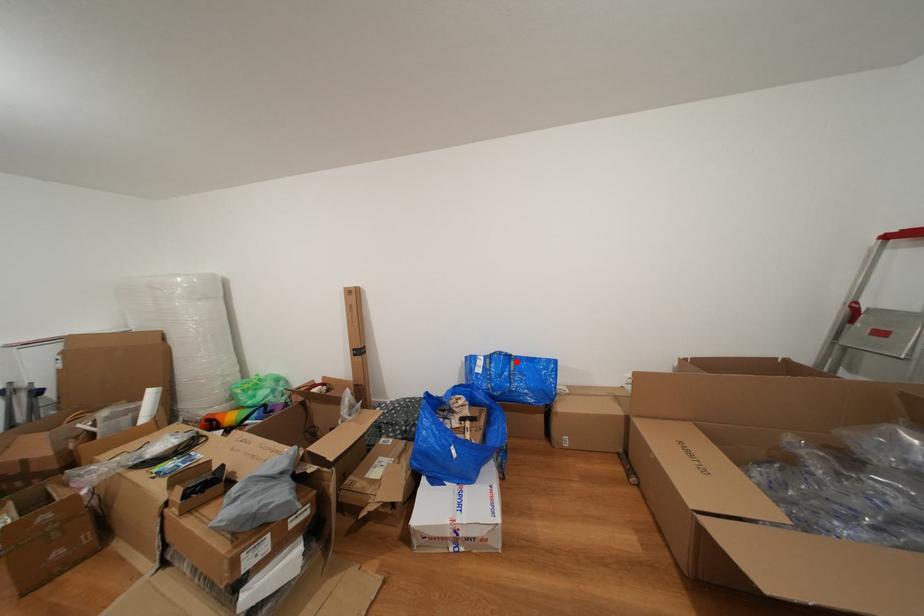
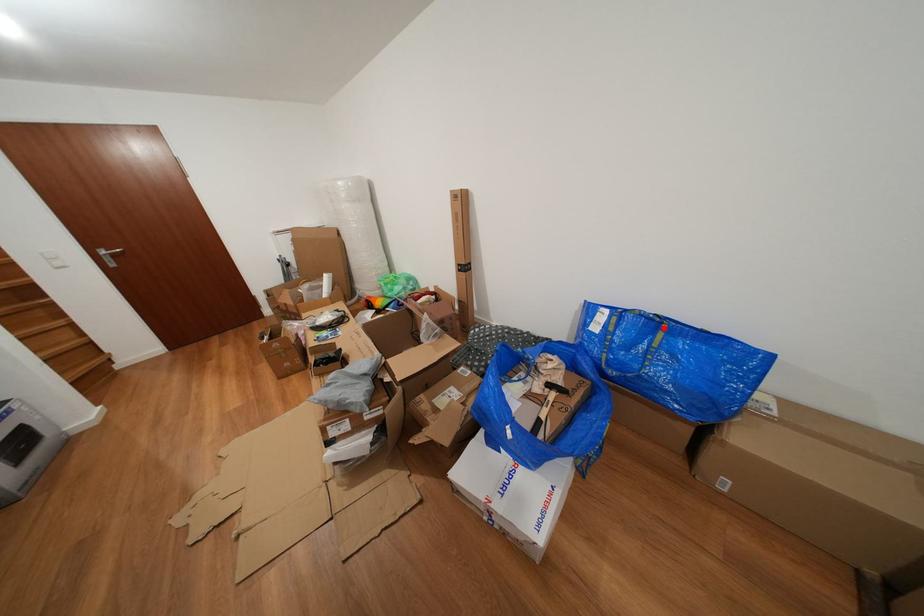
I am providing you with two images of the same scene from different viewpoints. A red point is marked on the first image and another point is marked on the second image. Is the marked point in image1 the same physical position as the marked point in image2?

Yes